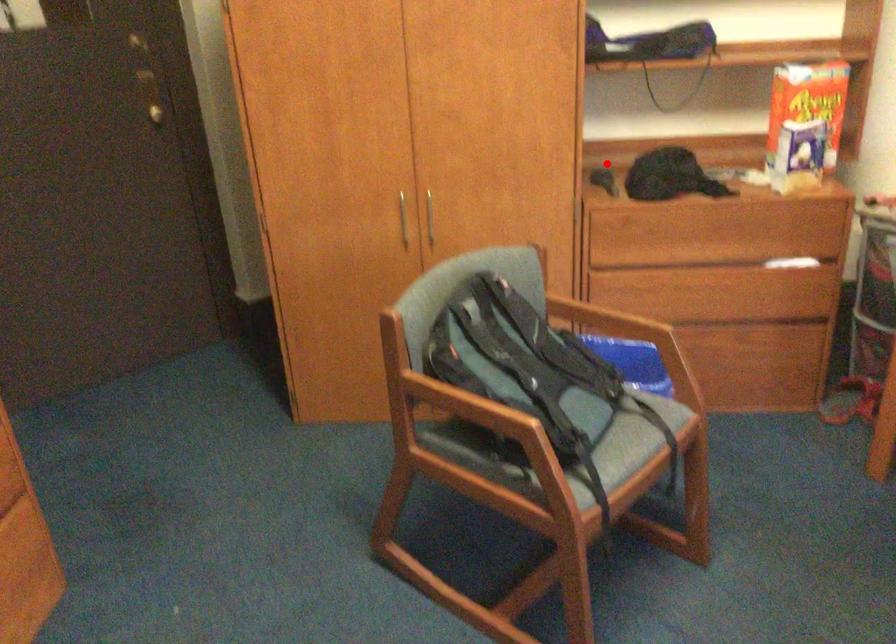
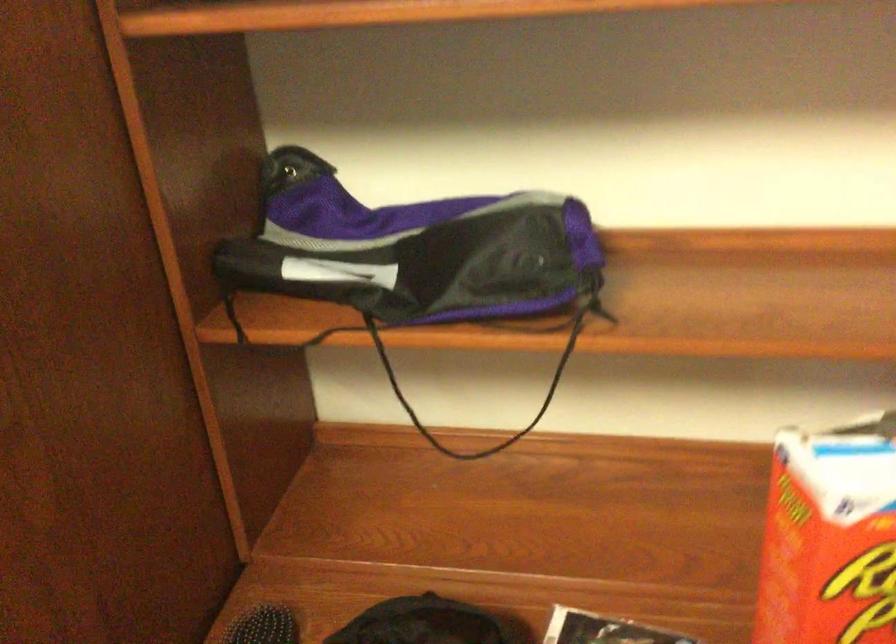
Question: I am providing you with two images of the same scene from different viewpoints. Image1 has a red point marked. In image2, the corresponding 3D location appears at what relative position? Reply with the corresponding letter.

Choices:
 (A) Closer
 (B) Farther

Answer: (A)